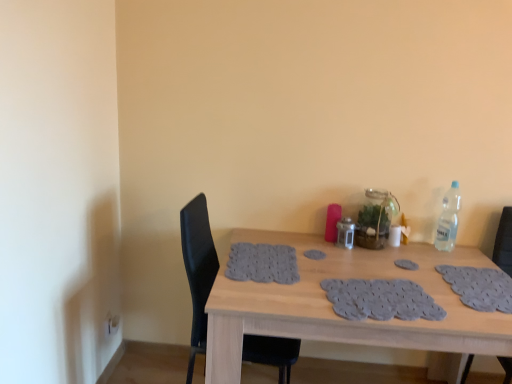
What are the coordinates of `vacant space behind gray fabric footprint at center, placed as the 1th footprint when sorted from left to right` in the screenshot? It's located at (320, 244).